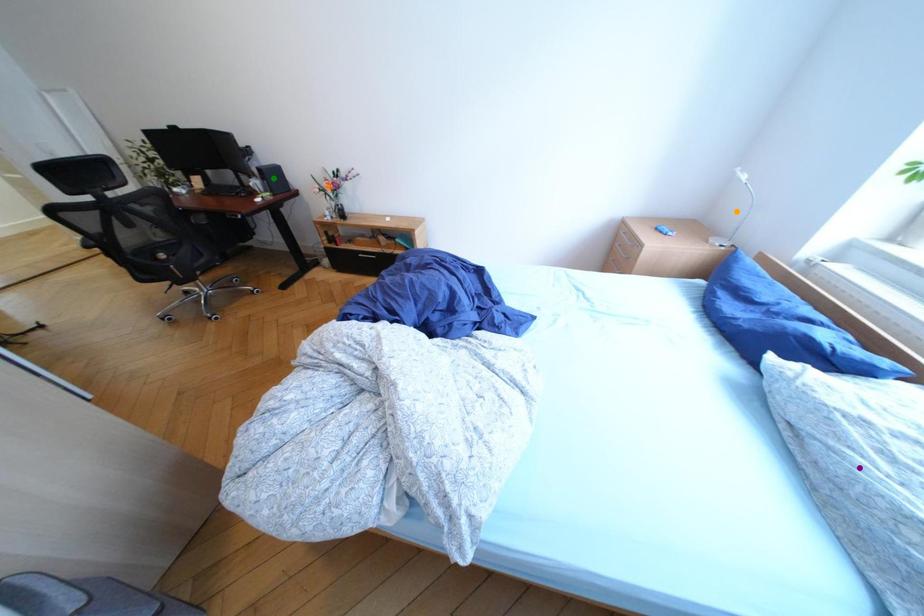
Order these from nearest to farthest:
orange point, green point, purple point

green point → orange point → purple point